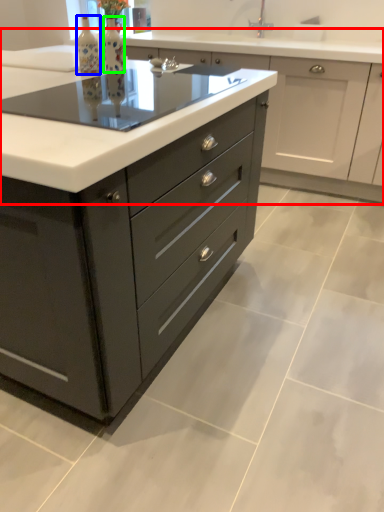
Question: Based on their relative distances, which object is nearer to cabinetry (highlighted by a red box)? Choose from bottle (highlighted by a blue box) and bottle (highlighted by a green box).

Choices:
 (A) bottle
 (B) bottle

Answer: (B)